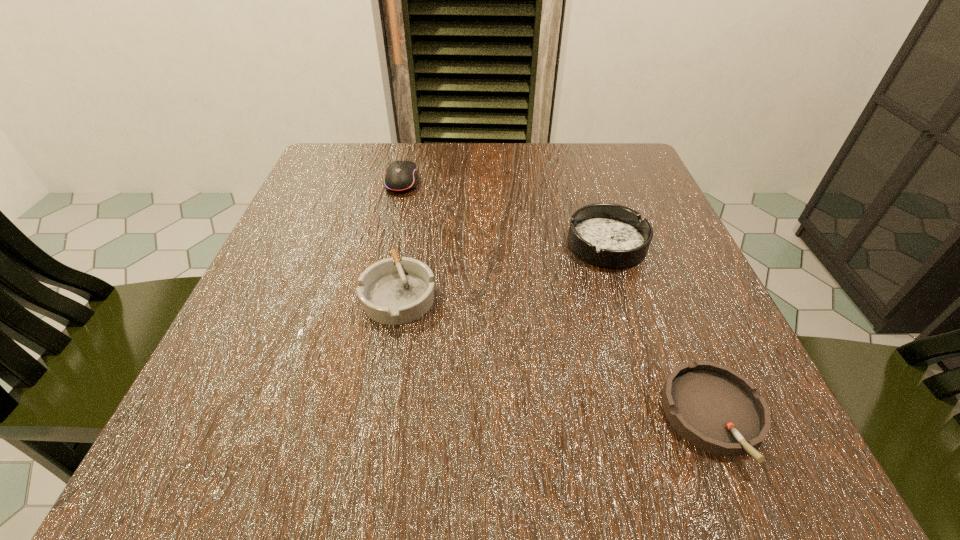
Find the location of a particular element. This screenshot has width=960, height=540. object present at the near right corner is located at coordinates (718, 410).

Where is `vacant space at the far edge of the desktop`? vacant space at the far edge of the desktop is located at coordinates (532, 175).

You are a GUI agent. You are given a task and a screenshot of the screen. Output one action in this format:
    pyautogui.click(x=<x>, y=<y>)
    Task: Click on the free region at the near edge of the desktop
    
    Given the screenshot: What is the action you would take?
    pyautogui.click(x=406, y=420)

This screenshot has width=960, height=540. In the image, there is a desktop. In order to click on vacant space at the left edge in this screenshot , I will do `click(310, 356)`.

Where is `vacant position at the right edge of the desktop`? The image size is (960, 540). vacant position at the right edge of the desktop is located at coordinates (656, 284).

At what (x,y) coordinates should I click in order to perform the action: click on free space at the far left corner of the desktop. Please return your answer as a coordinate pair (x, y). The height and width of the screenshot is (540, 960). Looking at the image, I should click on (338, 189).

Locate an element on the screen. This screenshot has height=540, width=960. free space between the computer mouse and the nearest object is located at coordinates (558, 299).

You are a GUI agent. You are given a task and a screenshot of the screen. Output one action in this format:
    pyautogui.click(x=<x>, y=<y>)
    Task: Click on the free point between the computer mouse and the nearest ashtray
    The height and width of the screenshot is (540, 960).
    Given the screenshot: What is the action you would take?
    pyautogui.click(x=558, y=299)

At what (x,y) coordinates should I click in order to perform the action: click on vacant area that lies between the nearest object and the leftmost ashtray. Please return your answer as a coordinate pair (x, y). This screenshot has width=960, height=540. Looking at the image, I should click on (557, 355).

This screenshot has height=540, width=960. Find the location of `free space between the nearest ashtray and the farthest object`. free space between the nearest ashtray and the farthest object is located at coordinates (558, 299).